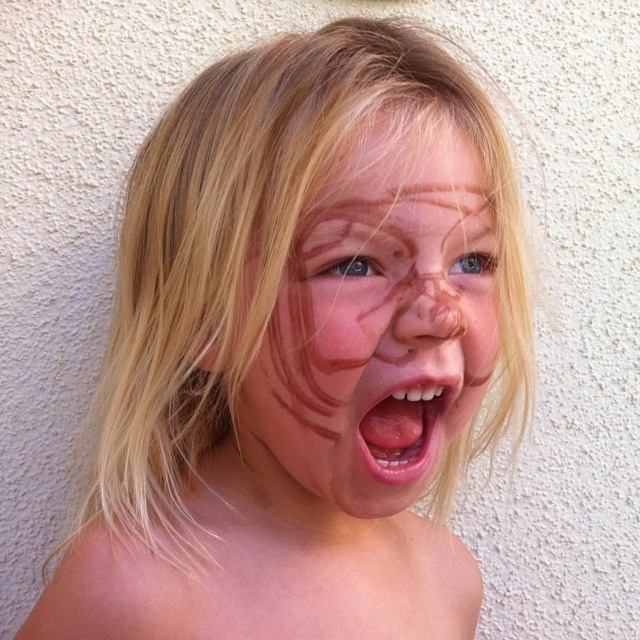
Looking at this image, in the image of the lively child with light blonde hair against a beige wall, you notice the pink glossy lips at center and the brown matte eye at center. Which of these two features is positioned higher on the child?

The pink glossy lips at center is taller than brown matte eye at center, so the pink glossy lips at center is positioned higher on the child.

You are a photographer trying to capture the child in the scene. You notice the smooth blonde hair at upper center and the blue matte eye at center. Which object is located above the other?

The smooth blonde hair at upper center is positioned over the blue matte eye at center.

From the picture: You are a photographer capturing a candid moment of a child with light blonde hair outdoors against a textured beige wall. The child has a streak of chocolate on their face and a playful expression. You need to focus your camera on the pink glossy lips at center. What are the coordinates where you should aim your camera lens?

The coordinates to aim the camera lens are at point [404,429], where the pink glossy lips at center are located.